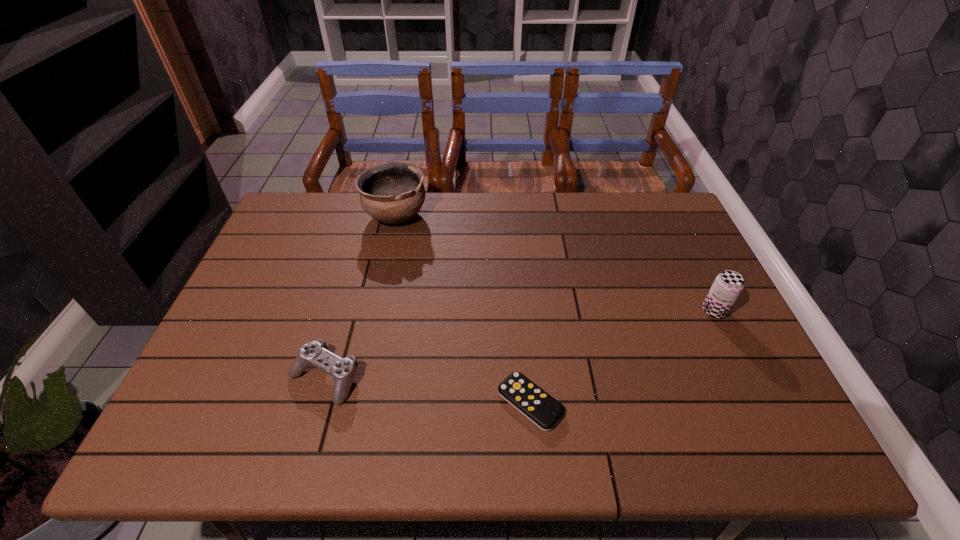
Where is `object that is positioned at the far edge`? object that is positioned at the far edge is located at coordinates (393, 192).

At what (x,y) coordinates should I click in order to perform the action: click on object at the near edge. Please return your answer as a coordinate pair (x, y). Looking at the image, I should click on (534, 403).

At what (x,y) coordinates should I click in order to perform the action: click on object situated at the right edge. Please return your answer as a coordinate pair (x, y). Looking at the image, I should click on (728, 285).

The width and height of the screenshot is (960, 540). I want to click on vacant region at the far edge of the desktop, so click(330, 214).

Locate an element on the screen. vacant space at the near edge of the desktop is located at coordinates (315, 436).

Image resolution: width=960 pixels, height=540 pixels. I want to click on free space at the left edge of the desktop, so click(x=200, y=374).

You are a GUI agent. You are given a task and a screenshot of the screen. Output one action in this format:
    pyautogui.click(x=<x>, y=<y>)
    Task: Click on the vacant space at the right edge of the desktop
    This screenshot has width=960, height=540.
    Given the screenshot: What is the action you would take?
    pyautogui.click(x=687, y=240)

You are a GUI agent. You are given a task and a screenshot of the screen. Output one action in this format:
    pyautogui.click(x=<x>, y=<y>)
    Task: Click on the free space at the far left corner of the desktop
    Image resolution: width=960 pixels, height=540 pixels.
    Given the screenshot: What is the action you would take?
    pyautogui.click(x=326, y=214)

Locate an element on the screen. This screenshot has width=960, height=540. free area in between the shortest object and the second shortest object is located at coordinates (427, 390).

Locate an element on the screen. empty space that is in between the second farthest object and the third tallest object is located at coordinates (519, 344).